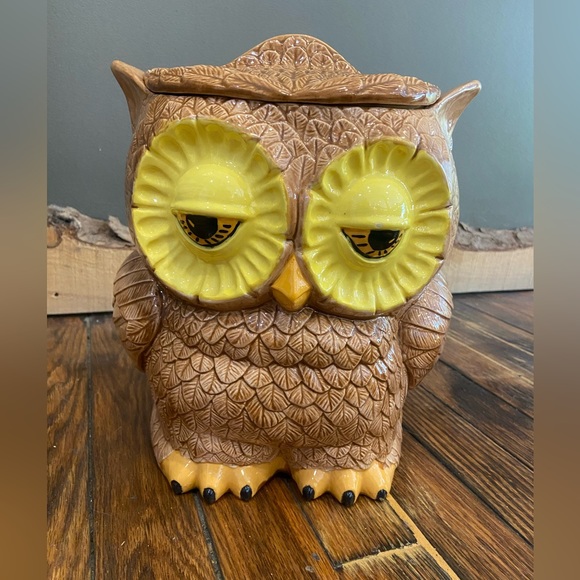
The image size is (580, 580). I want to click on wood floor, so click(139, 506), click(264, 532), click(367, 528), click(509, 416), click(442, 481).